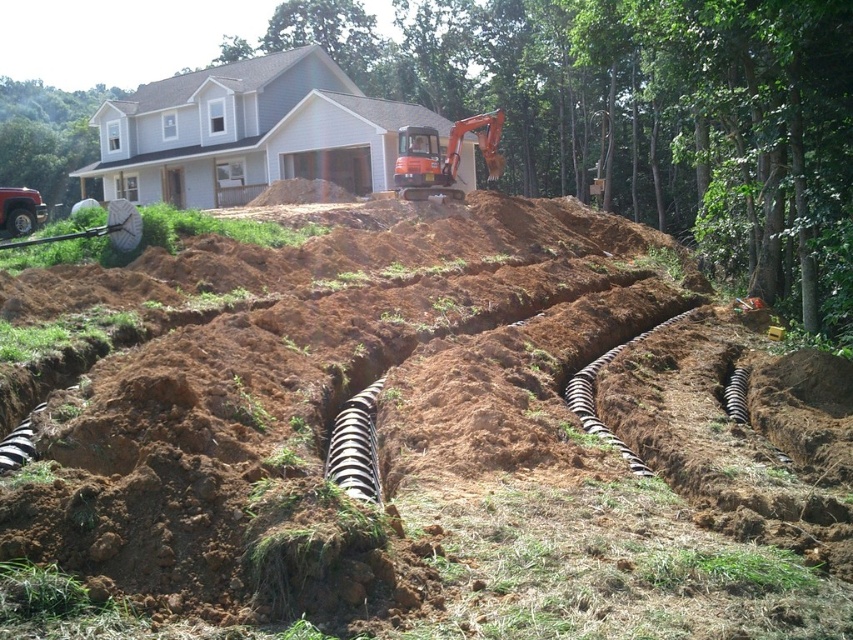
Which is more to the left, black rubber pipe at center or black striped pipe at center?

black rubber pipe at center is more to the left.

Can you confirm if black rubber pipe at center is bigger than black striped pipe at center?

Indeed, black rubber pipe at center has a larger size compared to black striped pipe at center.

Which is behind, point (648, 330) or point (733, 406)?

Positioned behind is point (648, 330).

This screenshot has height=640, width=853. What are the coordinates of `black rubber pipe at center` in the screenshot? It's located at (593, 397).

Image resolution: width=853 pixels, height=640 pixels. Describe the element at coordinates (444, 154) in the screenshot. I see `orange rubber excavator at center` at that location.

Does point (416, 182) lie behind point (370, 500)?

Yes, point (416, 182) is behind point (370, 500).

Is point (395, 177) positioned before point (352, 464)?

That is False.

Identify the location of orange rubber excavator at center. The image size is (853, 640). (444, 154).

Between orange rubber excavator at center and black striped pipe at center, which one is positioned lower?

Positioned lower is black striped pipe at center.

Who is taller, orange rubber excavator at center or black striped pipe at center?

Standing taller between the two is orange rubber excavator at center.

Does point (450, 148) come in front of point (743, 385)?

No.

This screenshot has width=853, height=640. I want to click on orange rubber excavator at center, so click(x=444, y=154).